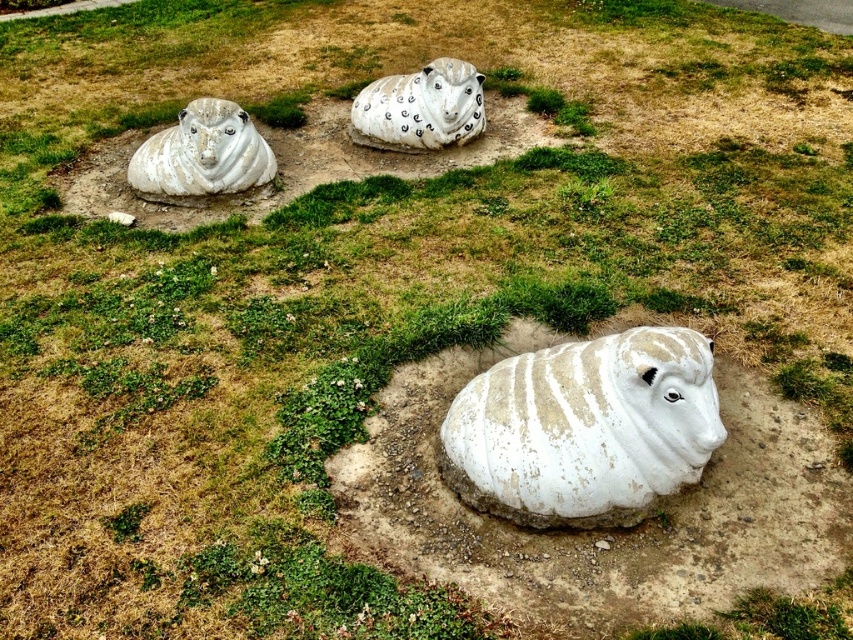
You are an art student analyzing the sculptures in the park. You need to determine which sculpture is taller between the white textured sheep at center and the white matte sheep at upper left. Based on the scene, which one is taller?

The white textured sheep at center is taller than the white matte sheep at upper left.

Looking at this image, you are standing at the center of the park and see the white matte sheep at upper left. What are its coordinates?

The white matte sheep at upper left is located at coordinates [202,152].

You are an art curator planning to move the white matte sheep at upper left and the white matte sheep at center to a new exhibition space. The entrance of the exhibition hall has a doorway that is 1.5 meters wide. Considering their widths, can both sculptures pass through the doorway individually?

The white matte sheep at upper left has a lesser width compared to white matte sheep at center. Since the doorway is 1.5 meters wide, both sculptures can pass through individually if their widths are less than 1.5 meters. However, the exact widths are not provided, so we cannot confirm for certain. But based on the comparison, the white matte sheep at upper left is narrower and more likely to fit through the doorway than the wider white matte sheep at center.